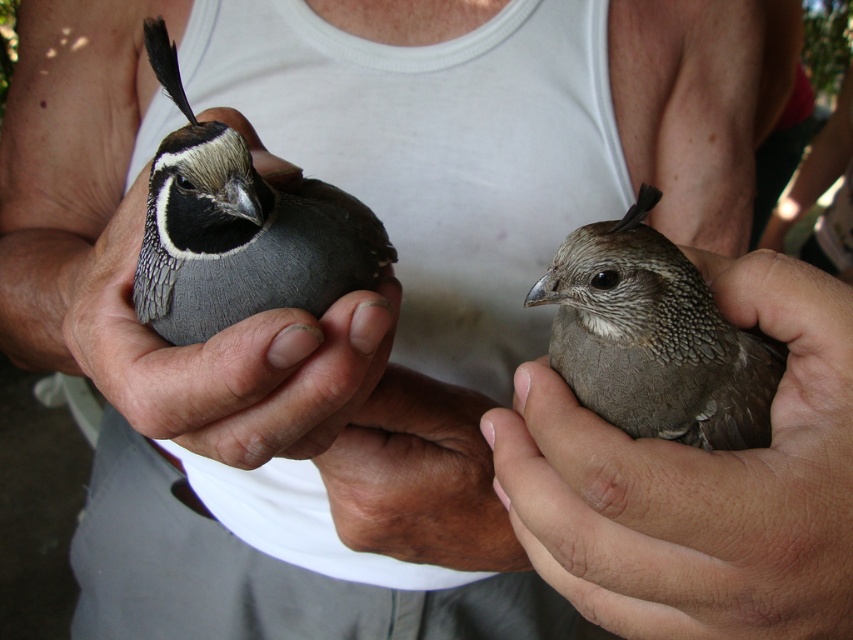
Does matte gray bird at left appear over gray speckled bird at right?

Yes.

Does point (248, 362) come behind point (625, 339)?

No, (248, 362) is closer to viewer.

Is point (135, 224) positioned before point (608, 406)?

No, it is behind (608, 406).

Image resolution: width=853 pixels, height=640 pixels. Find the location of `matte gray bird at left`. matte gray bird at left is located at coordinates (224, 360).

Does matte gray bird at left have a lesser height compared to gray speckled feather at left?

No.

Between matte gray bird at left and gray speckled feather at left, which one has more height?

matte gray bird at left

Where is `matte gray bird at left`? This screenshot has width=853, height=640. matte gray bird at left is located at coordinates (224, 360).

Is the position of gray speckled bird at right less distant than that of brown skin at center?

Yes, it is.

Is gray speckled bird at right below brown skin at center?

No.

Which is behind, point (664, 436) or point (325, 460)?

The point (325, 460) is behind.

I want to click on gray speckled bird at right, so click(654, 339).